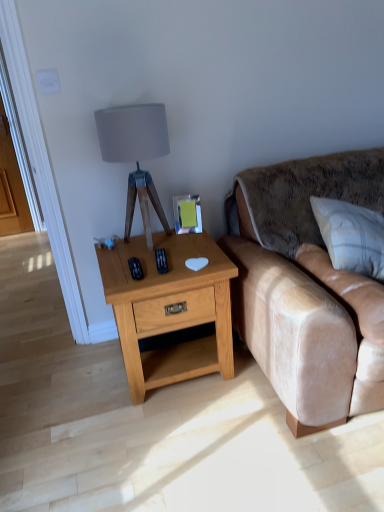
Question: Is light oak wood nightstand at center in front of white textured pillow at right?

Choices:
 (A) yes
 (B) no

Answer: (B)

Question: Is white textured pillow at right located within light oak wood nightstand at center?

Choices:
 (A) yes
 (B) no

Answer: (B)

Question: Is light oak wood nightstand at center behind white textured pillow at right?

Choices:
 (A) no
 (B) yes

Answer: (B)

Question: Considering the relative sizes of light oak wood nightstand at center and white textured pillow at right in the image provided, is light oak wood nightstand at center shorter than white textured pillow at right?

Choices:
 (A) yes
 (B) no

Answer: (B)

Question: Considering the relative sizes of light oak wood nightstand at center and white textured pillow at right in the image provided, is light oak wood nightstand at center wider than white textured pillow at right?

Choices:
 (A) yes
 (B) no

Answer: (A)

Question: Is light oak wood nightstand at center completely or partially outside of white textured pillow at right?

Choices:
 (A) no
 (B) yes

Answer: (B)

Question: Is velvet beige couch at right a part of white textured pillow at right?

Choices:
 (A) no
 (B) yes

Answer: (A)

Question: Is white textured pillow at right with velvet beige couch at right?

Choices:
 (A) yes
 (B) no

Answer: (B)

Question: From the image's perspective, does white textured pillow at right appear lower than velvet beige couch at right?

Choices:
 (A) yes
 (B) no

Answer: (B)

Question: Is white textured pillow at right in front of velvet beige couch at right?

Choices:
 (A) no
 (B) yes

Answer: (A)

Question: Is white textured pillow at right smaller than velvet beige couch at right?

Choices:
 (A) yes
 (B) no

Answer: (A)

Question: Does white textured pillow at right turn towards velvet beige couch at right?

Choices:
 (A) yes
 (B) no

Answer: (A)

Question: Does white textured pillow at right appear on the left side of light oak wood nightstand at center?

Choices:
 (A) no
 (B) yes

Answer: (A)